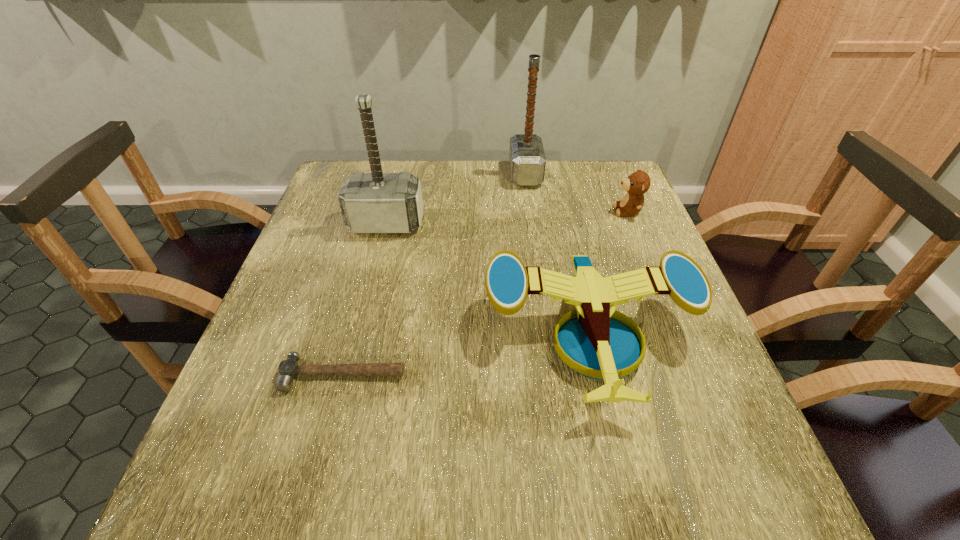
Locate an element on the screen. The image size is (960, 540). hammer that is the closest to the shortest hammer is located at coordinates click(376, 202).

Locate which hammer ranks second in proximity to the teddy bear. Please provide its 2D coordinates. Your answer should be formatted as a tuple, i.e. [(x, y)], where the tuple contains the x and y coordinates of a point satisfying the conditions above.

[(376, 202)]

You are a GUI agent. You are given a task and a screenshot of the screen. Output one action in this format:
    pyautogui.click(x=<x>, y=<y>)
    Task: Click on the free space in the image that satisfies the following two spatial constraints: 1. on the striking surface of the farthest object; 2. for striking with the head of the second nearest hammer
    The width and height of the screenshot is (960, 540).
    Given the screenshot: What is the action you would take?
    pyautogui.click(x=533, y=224)

You are a GUI agent. You are given a task and a screenshot of the screen. Output one action in this format:
    pyautogui.click(x=<x>, y=<y>)
    Task: Click on the vacant space that satisfies the following two spatial constraints: 1. on the face of the teddy bear; 2. on the striking face of the shortest object
    
    Given the screenshot: What is the action you would take?
    pyautogui.click(x=695, y=375)

At what (x,y) coordinates should I click in order to perform the action: click on vacant area in the image that satisfies the following two spatial constraints: 1. on the striking surface of the farthest hammer; 2. for striking with the head of the second nearest hammer. Please return your answer as a coordinate pair (x, y). Looking at the image, I should click on (533, 224).

Locate an element on the screen. vacant position in the image that satisfies the following two spatial constraints: 1. on the striking surface of the rightmost hammer; 2. on the striking face of the nearest hammer is located at coordinates (554, 375).

Find the location of `free space that satisfies the following two spatial constraints: 1. on the striking surface of the farthest hammer; 2. on the striking face of the shortest object`. free space that satisfies the following two spatial constraints: 1. on the striking surface of the farthest hammer; 2. on the striking face of the shortest object is located at coordinates (554, 375).